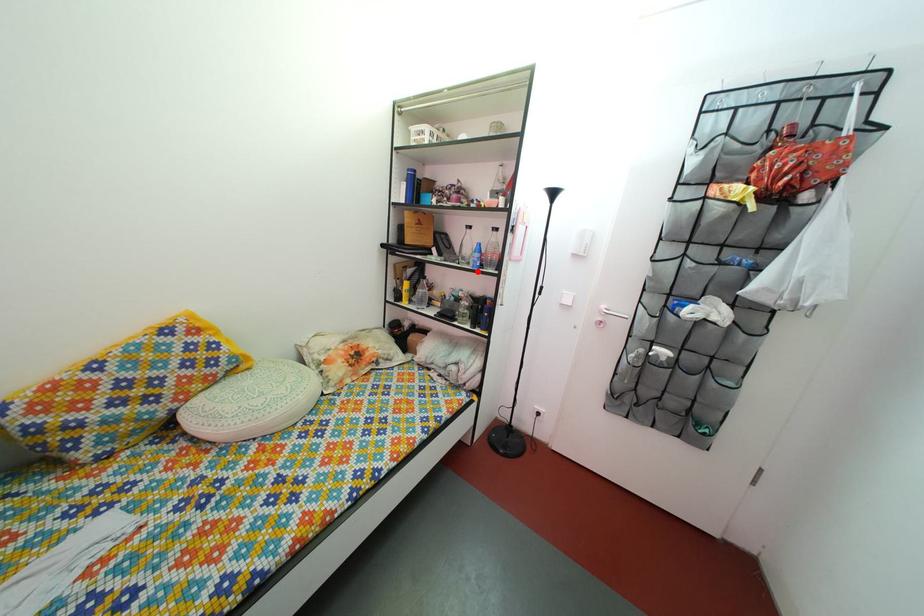
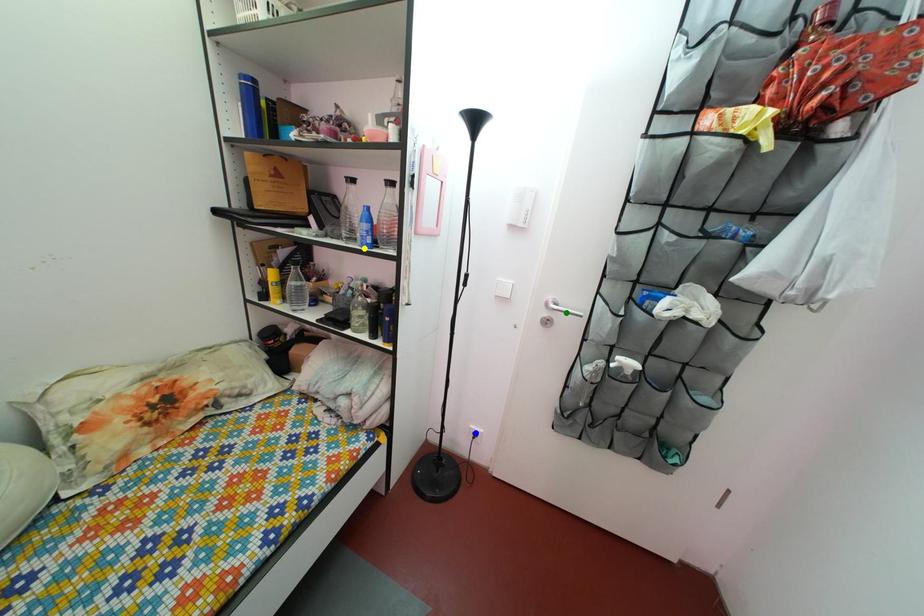
Question: I am providing you with two images of the same scene from different viewpoints. A red point is marked on the first image. You are given multiple points on the second image. Which point in image 2 is actually the same real-world point as the red point in image 1?

Choices:
 (A) yellow point
 (B) blue point
 (C) green point

Answer: (A)